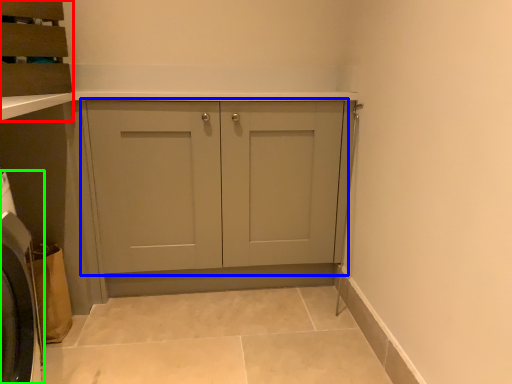
Question: Based on their relative distances, which object is farther from cabinetry (highlighted by a red box)? Choose from cupboard (highlighted by a blue box) and washing machine (highlighted by a green box).

Choices:
 (A) cupboard
 (B) washing machine

Answer: (A)